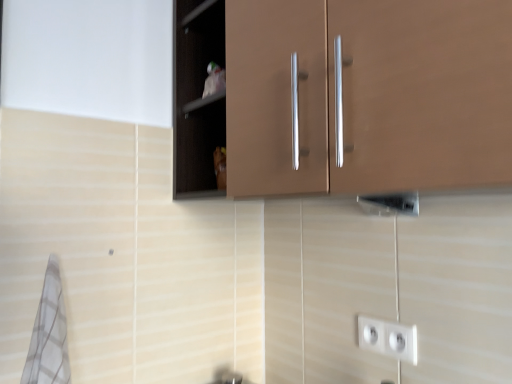
Question: In which direction should I rotate to look at matte brown cabinet at upper center, the 1th cabinetry viewed from the front?

Choices:
 (A) left
 (B) right

Answer: (B)

Question: Does white plastic socket at lower right have a smaller size compared to white checkered bath towel at lower left?

Choices:
 (A) no
 (B) yes

Answer: (B)

Question: From a real-world perspective, is white plastic socket at lower right over white checkered bath towel at lower left?

Choices:
 (A) yes
 (B) no

Answer: (B)

Question: Considering the relative sizes of white plastic socket at lower right and white checkered bath towel at lower left in the image provided, is white plastic socket at lower right wider than white checkered bath towel at lower left?

Choices:
 (A) yes
 (B) no

Answer: (B)

Question: From a real-world perspective, is white plastic socket at lower right under white checkered bath towel at lower left?

Choices:
 (A) no
 (B) yes

Answer: (B)

Question: Can you confirm if white plastic socket at lower right is thinner than white checkered bath towel at lower left?

Choices:
 (A) yes
 (B) no

Answer: (A)

Question: Could you tell me if white plastic socket at lower right is facing white checkered bath towel at lower left?

Choices:
 (A) yes
 (B) no

Answer: (B)

Question: Is brown matte cabinet at center, the 2th cabinetry from the front, facing away from white checkered bath towel at lower left?

Choices:
 (A) no
 (B) yes

Answer: (A)

Question: Is brown matte cabinet at center, the 2th cabinetry from the front, surrounding white checkered bath towel at lower left?

Choices:
 (A) yes
 (B) no

Answer: (B)

Question: Can you confirm if brown matte cabinet at center, which is the first cabinetry from back to front, is taller than white checkered bath towel at lower left?

Choices:
 (A) yes
 (B) no

Answer: (A)

Question: Is brown matte cabinet at center, which is the first cabinetry from back to front, positioned behind white checkered bath towel at lower left?

Choices:
 (A) yes
 (B) no

Answer: (A)

Question: Is brown matte cabinet at center, which is the first cabinetry from back to front, at the left side of white checkered bath towel at lower left?

Choices:
 (A) no
 (B) yes

Answer: (A)

Question: Does brown matte cabinet at center, the 2th cabinetry from the front, have a lesser height compared to white checkered bath towel at lower left?

Choices:
 (A) yes
 (B) no

Answer: (B)

Question: From a real-world perspective, is matte brown cabinet at upper center, the 1th cabinetry viewed from the front, over white checkered bath towel at lower left?

Choices:
 (A) no
 (B) yes

Answer: (B)